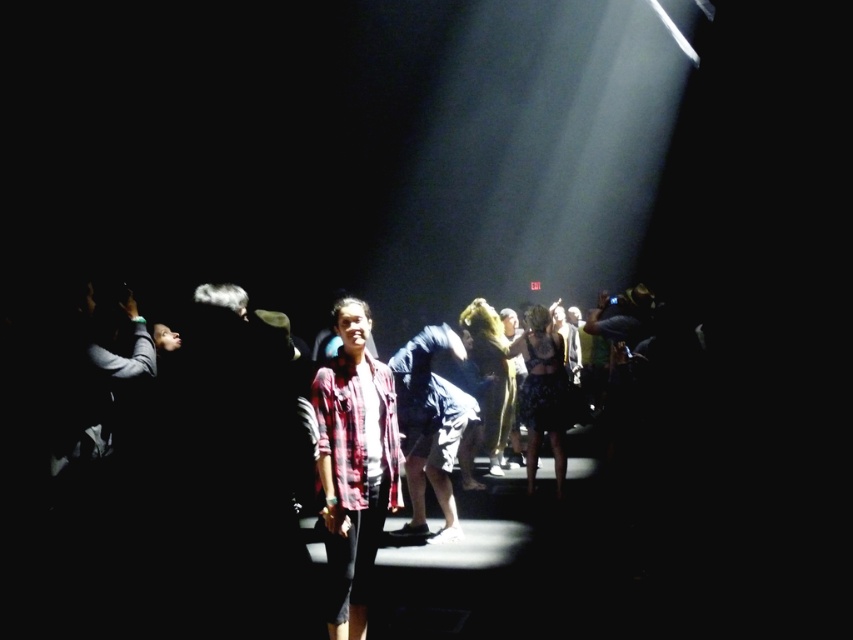
You are at a concert and notice two items in the spotlight at the center of the stage. The plaid fabric shirt at center and the denim shorts at center. Which item is higher up in the scene?

The plaid fabric shirt at center is taller than denim shorts at center, so the plaid fabric shirt at center is higher up in the scene.